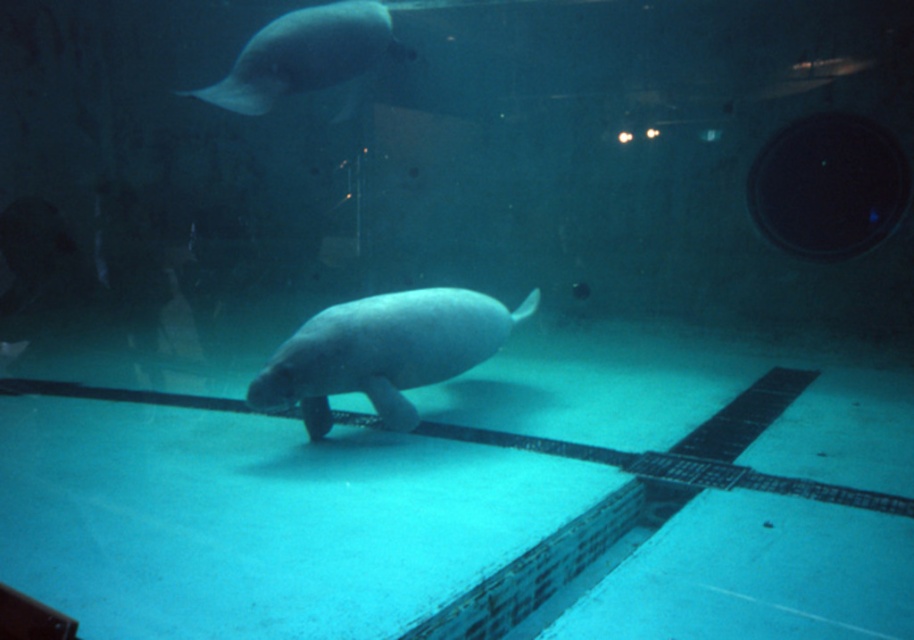
You are a marine biologist observing the underwater scene in the aquarium. You need to determine if the gray matte manatee at center can reach the smooth gray fish at upper left within 4 feet. Can it?

The distance between the gray matte manatee at center and the smooth gray fish at upper left is 3.89 feet, which is less than 4 feet. Therefore, the manatee can reach the smooth gray fish at upper left within the required distance.

You are a marine biologist observing the underwater scene in the aquarium. You notice the gray matte manatee at center and the smooth gray fish at upper left. Which of these two animals is closer to the observer?

The gray matte manatee at center is closer to the observer because it is in front of the smooth gray fish at upper left.

You are an aquarium guide explaining the layout of the enclosure to a visitor. Pointing to the gray matte manatee at center and the smooth gray fish at upper left, you want to describe their positions relative to each other. Which one is located to the right of the other?

The gray matte manatee at center is positioned on the right side of the smooth gray fish at upper left.